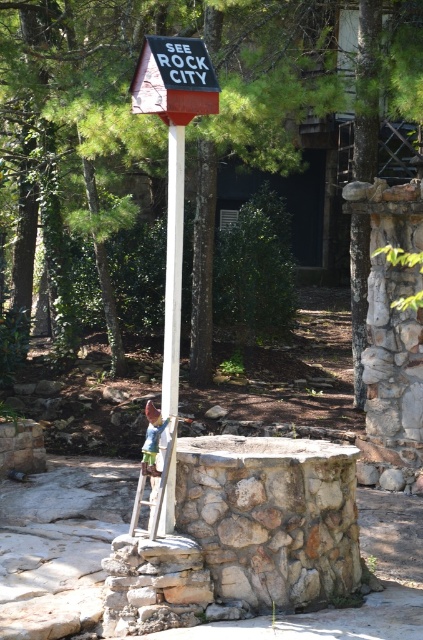
Question: In this image, where is white plastic pole at center located relative to wooden at lower center?

Choices:
 (A) below
 (B) above

Answer: (B)

Question: Estimate the real-world distances between objects in this image. Which object is closer to the wooden at lower center?

Choices:
 (A) red painted wood sign at center
 (B) white plastic pole at center

Answer: (B)

Question: Is red painted wood sign at center above white plastic pole at center?

Choices:
 (A) no
 (B) yes

Answer: (B)

Question: Which of the following is the farthest from the observer?

Choices:
 (A) wooden at lower center
 (B) white plastic pole at center

Answer: (A)

Question: Can you confirm if white plastic pole at center is thinner than wooden at lower center?

Choices:
 (A) yes
 (B) no

Answer: (A)

Question: Based on their relative distances, which object is nearer to the white plastic pole at center?

Choices:
 (A) wooden at lower center
 (B) red painted wood sign at center

Answer: (B)